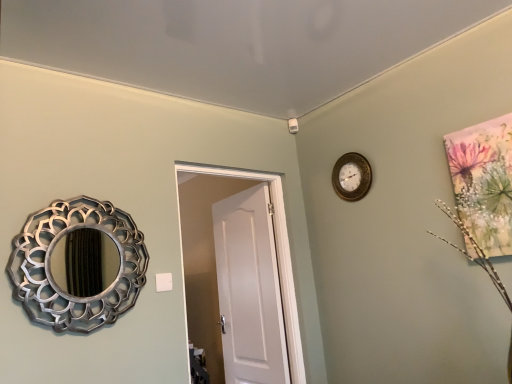
Locate an element on the screen. The image size is (512, 384). gold metallic wall clock at upper center is located at coordinates (352, 177).

Measure the distance between point [343,189] and camera.

They are 8.43 feet apart.

At what (x,y) coordinates should I click in order to perform the action: click on white matte door at center. Please return your answer as a coordinate pair (x, y). Looking at the image, I should click on (276, 251).

Describe the element at coordinates (51, 271) in the screenshot. I see `silver metallic mirror at left` at that location.

At what (x,y) coordinates should I click in order to perform the action: click on gold metallic wall clock at upper center. Please return your answer as a coordinate pair (x, y). Looking at the image, I should click on (352, 177).

Would you say gold metallic wall clock at upper center is a long distance from white matte door at center?

That's not correct — gold metallic wall clock at upper center is a little close to white matte door at center.

From a real-world perspective, which is physically below, gold metallic wall clock at upper center or white matte door at center?

white matte door at center.

Is gold metallic wall clock at upper center behind white matte door at center?

Yes, gold metallic wall clock at upper center is behind white matte door at center.

Does point (348, 188) come farther from viewer compared to point (228, 169)?

Yes, point (348, 188) is farther from viewer.

Which of these two, silver metallic mirror at left or white matte door at center, is bigger?

white matte door at center.

Considering the relative sizes of silver metallic mirror at left and white matte door at center in the image provided, is silver metallic mirror at left thinner than white matte door at center?

Yes.

Is point (37, 294) positioned in front of point (276, 245)?

That is True.

How many degrees apart are the facing directions of silver metallic mirror at left and white matte door at center?

There is a 0.0063-degree angle between the facing directions of silver metallic mirror at left and white matte door at center.

Between gold metallic wall clock at upper center and silver metallic mirror at left, which one has more height?

With more height is silver metallic mirror at left.

Does gold metallic wall clock at upper center appear on the right side of silver metallic mirror at left?

Indeed, gold metallic wall clock at upper center is positioned on the right side of silver metallic mirror at left.

What's the angular difference between gold metallic wall clock at upper center and silver metallic mirror at left's facing directions?

There is a 90.5-degree angle between the facing directions of gold metallic wall clock at upper center and silver metallic mirror at left.

Consider the image. Which object is wider, gold metallic wall clock at upper center or silver metallic mirror at left?

Wider between the two is silver metallic mirror at left.

Considering the sizes of white matte door at center and gold metallic wall clock at upper center in the image, is white matte door at center bigger or smaller than gold metallic wall clock at upper center?

In the image, white matte door at center appears to be larger than gold metallic wall clock at upper center.

Is gold metallic wall clock at upper center inside white matte door at center?

No, gold metallic wall clock at upper center is not inside white matte door at center.

Consider the image. From the image's perspective, is white matte door at center located above or below gold metallic wall clock at upper center?

white matte door at center is below gold metallic wall clock at upper center.

How far apart are white matte door at center and gold metallic wall clock at upper center?

A distance of 21.76 inches exists between white matte door at center and gold metallic wall clock at upper center.

Which of these two, silver metallic mirror at left or gold metallic wall clock at upper center, is bigger?

silver metallic mirror at left is bigger.

From the image's perspective, is silver metallic mirror at left on gold metallic wall clock at upper center?

Actually, silver metallic mirror at left appears below gold metallic wall clock at upper center in the image.

From a real-world perspective, does silver metallic mirror at left stand above gold metallic wall clock at upper center?

No.

From a real-world perspective, does white matte door at center stand above silver metallic mirror at left?

Incorrect, from a real-world perspective, white matte door at center is lower than silver metallic mirror at left.

Considering the sizes of white matte door at center and silver metallic mirror at left in the image, is white matte door at center taller or shorter than silver metallic mirror at left?

Clearly, white matte door at center is taller compared to silver metallic mirror at left.

Considering the positions of points (176, 171) and (136, 238), is point (176, 171) farther from camera compared to point (136, 238)?

Yes, point (176, 171) is behind point (136, 238).

Where is `wall clock behind the white matte door at center`? wall clock behind the white matte door at center is located at coordinates [x=352, y=177].

The width and height of the screenshot is (512, 384). In order to click on mirror above the white matte door at center (from the image's perspective) in this screenshot , I will do click(51, 271).

Estimate the real-world distances between objects in this image. Which object is closer to silver metallic mirror at left, gold metallic wall clock at upper center or white matte door at center?

The object closer to silver metallic mirror at left is white matte door at center.

Looking at the image, which one is located closer to gold metallic wall clock at upper center, silver metallic mirror at left or white matte door at center?

white matte door at center is closer to gold metallic wall clock at upper center.

Looking at the image, which one is located further to silver metallic mirror at left, white matte door at center or gold metallic wall clock at upper center?

gold metallic wall clock at upper center.

Based on their spatial positions, is silver metallic mirror at left or gold metallic wall clock at upper center closer to white matte door at center?

gold metallic wall clock at upper center lies closer to white matte door at center than the other object.

In the scene shown: From the image, which object appears to be farther from gold metallic wall clock at upper center, white matte door at center or silver metallic mirror at left?

Based on the image, silver metallic mirror at left appears to be further to gold metallic wall clock at upper center.

Based on their spatial positions, is gold metallic wall clock at upper center or silver metallic mirror at left further from white matte door at center?

silver metallic mirror at left lies further to white matte door at center than the other object.

Where is `door between silver metallic mirror at left and gold metallic wall clock at upper center`? door between silver metallic mirror at left and gold metallic wall clock at upper center is located at coordinates (276, 251).